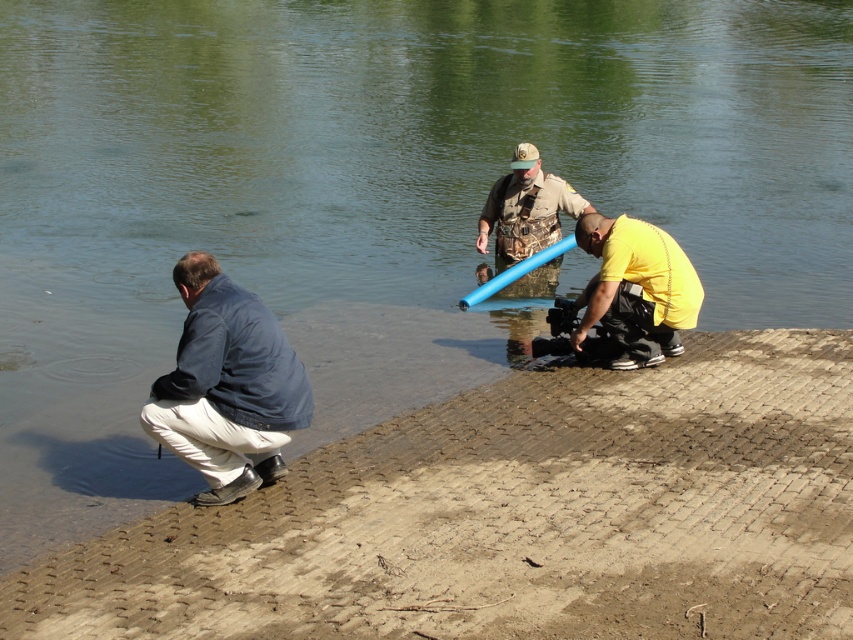
Question: Does blue fabric jacket at lower left have a smaller size compared to camouflage shirt at center?

Choices:
 (A) no
 (B) yes

Answer: (B)

Question: Does blue fabric jacket at lower left appear on the right side of camouflage shirt at center?

Choices:
 (A) no
 (B) yes

Answer: (A)

Question: Which object is closer to the camera taking this photo?

Choices:
 (A) yellow matte shirt at lower center
 (B) blue fabric jacket at lower left

Answer: (B)

Question: Is blue fabric jacket at lower left closer to the viewer compared to camouflage shirt at center?

Choices:
 (A) yes
 (B) no

Answer: (A)

Question: Which point is farther to the camera?

Choices:
 (A) camouflage shirt at center
 (B) blue fabric jacket at lower left
 (C) brown textured shore at lower left

Answer: (A)

Question: Which is nearer to the brown textured shore at lower left?

Choices:
 (A) camouflage shirt at center
 (B) blue fabric jacket at lower left

Answer: (B)